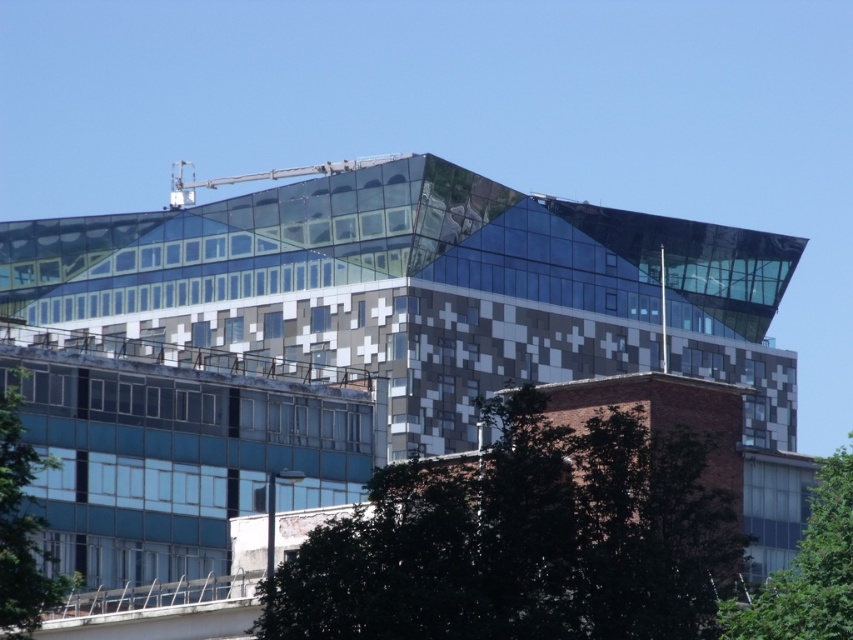
Question: Which of the following is the farthest from the observer?

Choices:
 (A) green leafy tree at lower right
 (B) green leafy tree at lower left
 (C) green leafy tree at center

Answer: (B)

Question: Is green leafy tree at center positioned in front of green leafy tree at lower right?

Choices:
 (A) no
 (B) yes

Answer: (A)

Question: Is green leafy tree at lower right to the right of green leafy tree at lower left from the viewer's perspective?

Choices:
 (A) no
 (B) yes

Answer: (B)

Question: Estimate the real-world distances between objects in this image. Which object is farther from the green leafy tree at center?

Choices:
 (A) green leafy tree at lower left
 (B) green leafy tree at lower right

Answer: (A)

Question: Which of these objects is positioned closest to the green leafy tree at lower left?

Choices:
 (A) green leafy tree at center
 (B) green leafy tree at lower right

Answer: (A)

Question: Can you confirm if green leafy tree at lower right is smaller than green leafy tree at lower left?

Choices:
 (A) no
 (B) yes

Answer: (A)